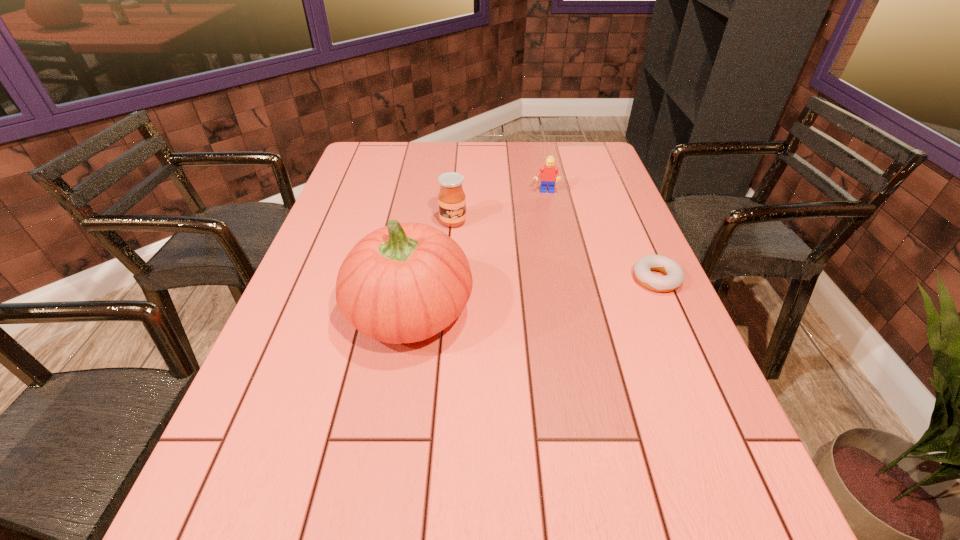
The image size is (960, 540). Find the location of `free space on the desktop that is between the tallest object and the shortest object and is positioned on the front-facing side of the farthest object`. free space on the desktop that is between the tallest object and the shortest object and is positioned on the front-facing side of the farthest object is located at coordinates (549, 293).

At what (x,y) coordinates should I click in order to perform the action: click on free space on the desktop that is between the pumpkin and the doughnut and is positioned on the front-facing side of the second tallest object. Please return your answer as a coordinate pair (x, y). Looking at the image, I should click on (507, 299).